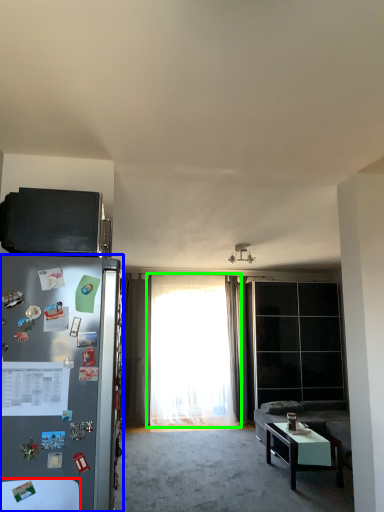
Question: Based on their relative distances, which object is nearer to table (highlighted by a red box)? Choose from refrigerator (highlighted by a blue box) and curtain (highlighted by a green box).

Choices:
 (A) refrigerator
 (B) curtain

Answer: (A)